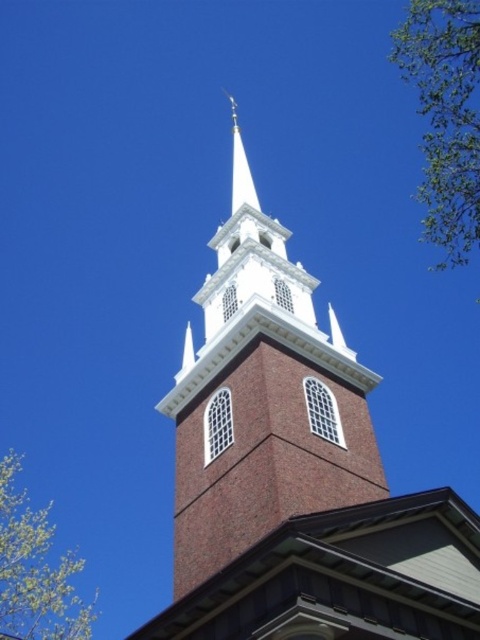
You are standing at the base of the church steeple and want to walk to both the green leafy tree at upper right and the green leafy tree at upper left. Which tree should you go to first if you want to minimize the total distance walked?

You should go to either tree first since both are equidistant from the steeple. The total distance will be the same regardless of the order.

You are a bird flying towards the brick steeple at center and the green leafy tree at upper left. Which one will you reach first?

The brick steeple at center will be reached first because it is in front of the green leafy tree at upper left, meaning it is closer to your current position.